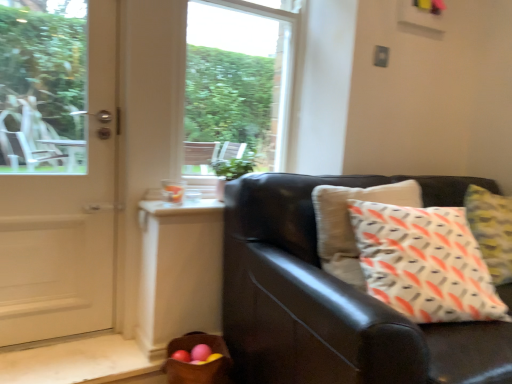
Question: Can transparent glass window at center be found inside white glossy door at left?

Choices:
 (A) yes
 (B) no

Answer: (B)

Question: Can you confirm if white glossy door at left is shorter than transparent glass window at center?

Choices:
 (A) no
 (B) yes

Answer: (A)

Question: Is white glossy door at left facing towards transparent glass window at center?

Choices:
 (A) no
 (B) yes

Answer: (A)

Question: Does white glossy door at left have a lesser width compared to transparent glass window at center?

Choices:
 (A) no
 (B) yes

Answer: (A)

Question: From a real-world perspective, is white glossy door at left on top of transparent glass window at center?

Choices:
 (A) no
 (B) yes

Answer: (A)

Question: Is point (194, 342) positioned closer to the camera than point (247, 354)?

Choices:
 (A) closer
 (B) farther

Answer: (B)

Question: Is brown woven basket at lower left spatially inside matte black couch at right, or outside of it?

Choices:
 (A) outside
 (B) inside

Answer: (A)

Question: Considering the positions of brown woven basket at lower left and matte black couch at right in the image, is brown woven basket at lower left taller or shorter than matte black couch at right?

Choices:
 (A) short
 (B) tall

Answer: (A)

Question: Based on their positions, is brown woven basket at lower left located to the left or right of matte black couch at right?

Choices:
 (A) right
 (B) left

Answer: (B)

Question: From a real-world perspective, relative to brown woven basket at lower left, is matte black couch at right vertically above or below?

Choices:
 (A) below
 (B) above

Answer: (B)

Question: In terms of height, does matte black couch at right look taller or shorter compared to brown woven basket at lower left?

Choices:
 (A) tall
 (B) short

Answer: (A)

Question: From the image's perspective, is matte black couch at right above or below brown woven basket at lower left?

Choices:
 (A) below
 (B) above

Answer: (B)

Question: Considering the positions of matte black couch at right and brown woven basket at lower left in the image, is matte black couch at right bigger or smaller than brown woven basket at lower left?

Choices:
 (A) big
 (B) small

Answer: (A)

Question: Considering the positions of matte black couch at right and white glossy door at left in the image, is matte black couch at right bigger or smaller than white glossy door at left?

Choices:
 (A) small
 (B) big

Answer: (B)

Question: From a real-world perspective, relative to white glossy door at left, is matte black couch at right vertically above or below?

Choices:
 (A) above
 (B) below

Answer: (B)